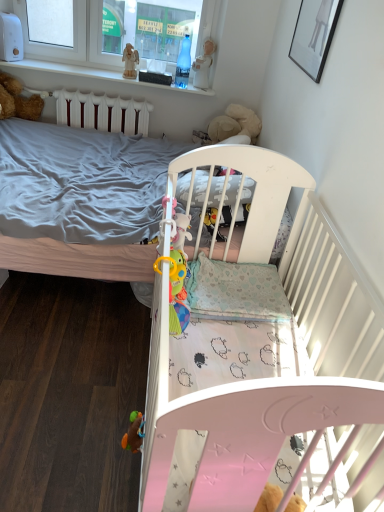
Where is `white plastic statue at upper center, which is the second toy from front to back`? This screenshot has height=512, width=384. white plastic statue at upper center, which is the second toy from front to back is located at coordinates (203, 65).

What are the coordinates of `white plastic window frame at upper left` in the screenshot? It's located at (74, 46).

In order to face multicolored plastic toy at lower left, the 1th toy ordered from the bottom, should I rotate leftwards or rightwards?

It's best to rotate left around 7.769 degrees.

The height and width of the screenshot is (512, 384). Describe the element at coordinates (134, 433) in the screenshot. I see `multicolored plastic toy at lower left, positioned as the 2th toy in back-to-front order` at that location.

The width and height of the screenshot is (384, 512). What are the coordinates of `white wooden balustrade at upper center` in the screenshot? It's located at (76, 72).

Locate an element on the screen. window frame above the multicolored plastic toy at lower left, the first toy positioned from the front (from the image's perspective) is located at coordinates (74, 46).

Between point (69, 50) and point (129, 439), which one is positioned behind?

Positioned behind is point (69, 50).

Which of these two, white plastic window frame at upper left or multicolored plastic toy at lower left, the 1th toy ordered from the bottom, is wider?

Wider between the two is white plastic window frame at upper left.

In terms of height, does multicolored plastic toy at lower left, the 1th toy ordered from the bottom, look taller or shorter compared to white glossy picture frame at upper right?

Clearly, multicolored plastic toy at lower left, the 1th toy ordered from the bottom, is shorter compared to white glossy picture frame at upper right.

Is multicolored plastic toy at lower left, positioned as the 2th toy in right-to-left order, with white glossy picture frame at upper right?

There is a gap between multicolored plastic toy at lower left, positioned as the 2th toy in right-to-left order, and white glossy picture frame at upper right.

Does point (130, 436) lie in front of point (318, 40)?

Yes, point (130, 436) is in front of point (318, 40).

Considering the sizes of white wooden balustrade at upper center and white plastic statue at upper center, which is the second toy from front to back, in the image, is white wooden balustrade at upper center taller or shorter than white plastic statue at upper center, which is the second toy from front to back,?

white wooden balustrade at upper center is shorter than white plastic statue at upper center, which is the second toy from front to back.

Considering the relative positions of white wooden balustrade at upper center and white plastic statue at upper center, which is the 1th toy in top-to-bottom order, in the image provided, is white wooden balustrade at upper center to the left or to the right of white plastic statue at upper center, which is the 1th toy in top-to-bottom order,?

white wooden balustrade at upper center is to the left of white plastic statue at upper center, which is the 1th toy in top-to-bottom order.

Is white wooden balustrade at upper center turned away from white plastic statue at upper center, which is the 1th toy in top-to-bottom order?

No, white wooden balustrade at upper center is not facing away from white plastic statue at upper center, which is the 1th toy in top-to-bottom order.

Based on the photo, how different are the orientations of white wooden balustrade at upper center and white plastic statue at upper center, the first toy when ordered from right to left, in degrees?

29.6 degrees separate the facing orientations of white wooden balustrade at upper center and white plastic statue at upper center, the first toy when ordered from right to left.

In the scene shown: From the image's perspective, is multicolored plastic toy at lower left, placed as the second toy when sorted from top to bottom, on top of wooden angel at upper center?

No, from the image's perspective, multicolored plastic toy at lower left, placed as the second toy when sorted from top to bottom, is not on top of wooden angel at upper center.

Identify the location of doll that appears behind the multicolored plastic toy at lower left, positioned as the 2th toy in back-to-front order. This screenshot has height=512, width=384. (130, 61).

Could you tell me if multicolored plastic toy at lower left, positioned as the 2th toy in right-to-left order, is facing wooden angel at upper center?

No, multicolored plastic toy at lower left, positioned as the 2th toy in right-to-left order, is not turned towards wooden angel at upper center.

In the scene shown: Does multicolored plastic toy at lower left, the first toy positioned from the front, have a smaller size compared to wooden angel at upper center?

Indeed, multicolored plastic toy at lower left, the first toy positioned from the front, has a smaller size compared to wooden angel at upper center.

Is multicolored plastic toy at lower left, the first toy positioned from the front, taller than white wooden balustrade at upper center?

Indeed, multicolored plastic toy at lower left, the first toy positioned from the front, has a greater height compared to white wooden balustrade at upper center.

Does point (127, 432) come closer to viewer compared to point (69, 74)?

Yes.

Which of these two, multicolored plastic toy at lower left, the first toy positioned from the front, or white wooden balustrade at upper center, is smaller?

Smaller between the two is multicolored plastic toy at lower left, the first toy positioned from the front.

Does white glossy picture frame at upper right have a lesser width compared to white wooden balustrade at upper center?

Yes.

Is white glossy picture frame at upper right in front of or behind white wooden balustrade at upper center in the image?

Clearly, white glossy picture frame at upper right is in front of white wooden balustrade at upper center.

From a real-world perspective, is white glossy picture frame at upper right physically located above or below white wooden balustrade at upper center?

From a real-world perspective, white glossy picture frame at upper right is physically above white wooden balustrade at upper center.

Between white plastic window frame at upper left and white glossy picture frame at upper right, which one has less height?

Standing shorter between the two is white glossy picture frame at upper right.

Is white glossy picture frame at upper right surrounded by white plastic window frame at upper left?

Actually, white glossy picture frame at upper right is outside white plastic window frame at upper left.

Is white plastic window frame at upper left not close to white glossy picture frame at upper right?

That's right, there is a large distance between white plastic window frame at upper left and white glossy picture frame at upper right.

The height and width of the screenshot is (512, 384). Find the location of `window frame above the white glossy picture frame at upper right (from the image's perspective)`. window frame above the white glossy picture frame at upper right (from the image's perspective) is located at coordinates (74, 46).

Where is `window frame behind the multicolored plastic toy at lower left, the first toy positioned from the front`? This screenshot has height=512, width=384. window frame behind the multicolored plastic toy at lower left, the first toy positioned from the front is located at coordinates (74, 46).

From a real-world perspective, starting from the white glossy picture frame at upper right, which toy is the 2nd one below it? Please provide its 2D coordinates.

[(134, 433)]

From the image, which object appears to be nearer to white wooden balustrade at upper center, white plastic statue at upper center, which is the second toy from bottom to top, or white glossy picture frame at upper right?

Based on the image, white plastic statue at upper center, which is the second toy from bottom to top, appears to be nearer to white wooden balustrade at upper center.

Looking at the image, which one is located further to white wooden balustrade at upper center, white glossy picture frame at upper right or wooden angel at upper center?

Among the two, white glossy picture frame at upper right is located further to white wooden balustrade at upper center.

Looking at the image, which one is located further to wooden angel at upper center, white glossy picture frame at upper right or white wooden balustrade at upper center?

white glossy picture frame at upper right lies further to wooden angel at upper center than the other object.

Estimate the real-world distances between objects in this image. Which object is closer to white plastic statue at upper center, which is the 1th toy in top-to-bottom order, white wooden balustrade at upper center or wooden angel at upper center?

Based on the image, wooden angel at upper center appears to be nearer to white plastic statue at upper center, which is the 1th toy in top-to-bottom order.

When comparing their distances from multicolored plastic toy at lower left, positioned as the 2th toy in back-to-front order, does wooden angel at upper center or white glossy picture frame at upper right seem further?

wooden angel at upper center.

Looking at the image, which one is located closer to white plastic statue at upper center, which is the 1th toy from back to front, white glossy picture frame at upper right or wooden angel at upper center?

The object closer to white plastic statue at upper center, which is the 1th toy from back to front, is wooden angel at upper center.

Based on their spatial positions, is white wooden balustrade at upper center or multicolored plastic toy at lower left, placed as the second toy when sorted from top to bottom, further from white plastic statue at upper center, which appears as the 2th toy when viewed from the left?

multicolored plastic toy at lower left, placed as the second toy when sorted from top to bottom.

Looking at this image, which object lies nearer to the anchor point multicolored plastic toy at lower left, marked as the 1th toy in a left-to-right arrangement, white wooden balustrade at upper center or white glossy picture frame at upper right?

Based on the image, white glossy picture frame at upper right appears to be nearer to multicolored plastic toy at lower left, marked as the 1th toy in a left-to-right arrangement.

Find the location of a particular element. Image resolution: width=384 pixels, height=512 pixels. doll between white plastic window frame at upper left and white plastic statue at upper center, which is the 1th toy from back to front, in the horizontal direction is located at coordinates (130, 61).

Identify the location of balustrade between white plastic statue at upper center, which appears as the 2th toy when viewed from the left, and multicolored plastic toy at lower left, positioned as the 2th toy in back-to-front order, from top to bottom. (76, 72).

At what (x,y) coordinates should I click in order to perform the action: click on picture frame that lies between white plastic statue at upper center, which appears as the 2th toy when viewed from the left, and multicolored plastic toy at lower left, positioned as the 2th toy in back-to-front order, from top to bottom. Please return your answer as a coordinate pair (x, y). The image size is (384, 512). Looking at the image, I should click on (314, 35).

Identify the location of picture frame between white wooden balustrade at upper center and multicolored plastic toy at lower left, the first toy positioned from the front, from top to bottom. (314, 35).